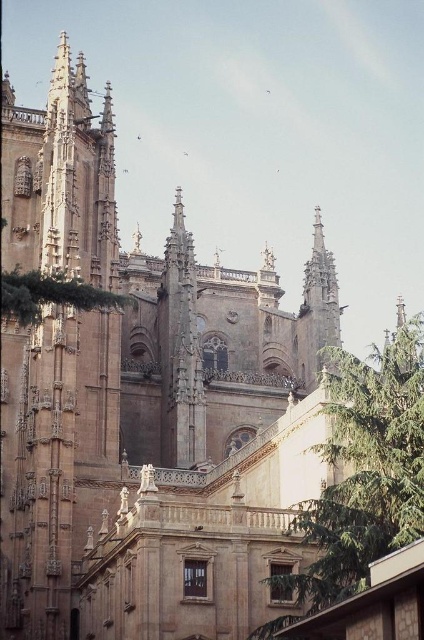
Question: Among these points, which one is farthest from the camera?

Choices:
 (A) (320, 579)
 (B) (55, 300)

Answer: (B)

Question: Does green leafy tree at center have a larger size compared to green leafy tree at upper left?

Choices:
 (A) yes
 (B) no

Answer: (A)

Question: Which of the following is the closest to the observer?

Choices:
 (A) (373, 403)
 (B) (16, 292)

Answer: (B)

Question: Does green leafy tree at center have a lesser width compared to green leafy tree at upper left?

Choices:
 (A) yes
 (B) no

Answer: (B)

Question: Does green leafy tree at center appear on the right side of green leafy tree at upper left?

Choices:
 (A) yes
 (B) no

Answer: (A)